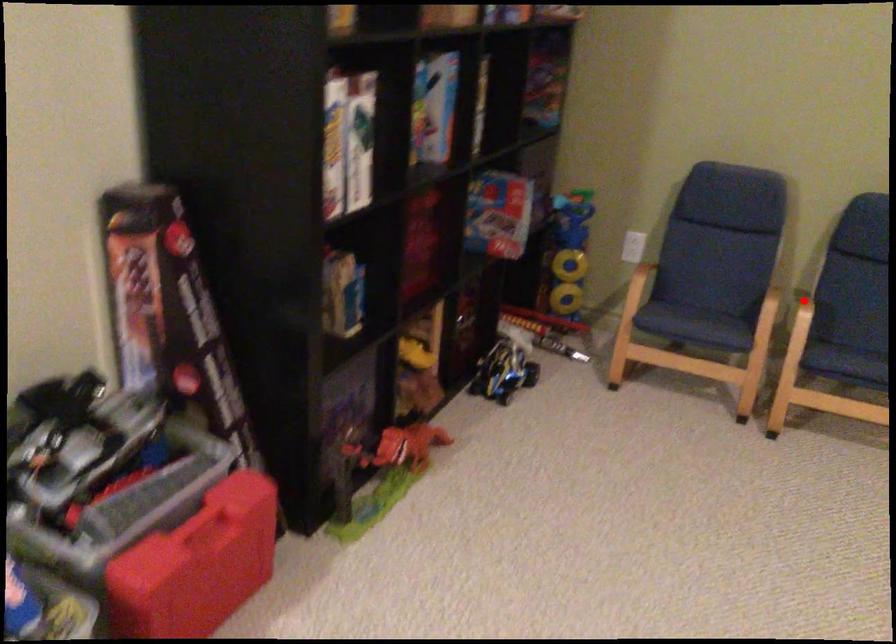
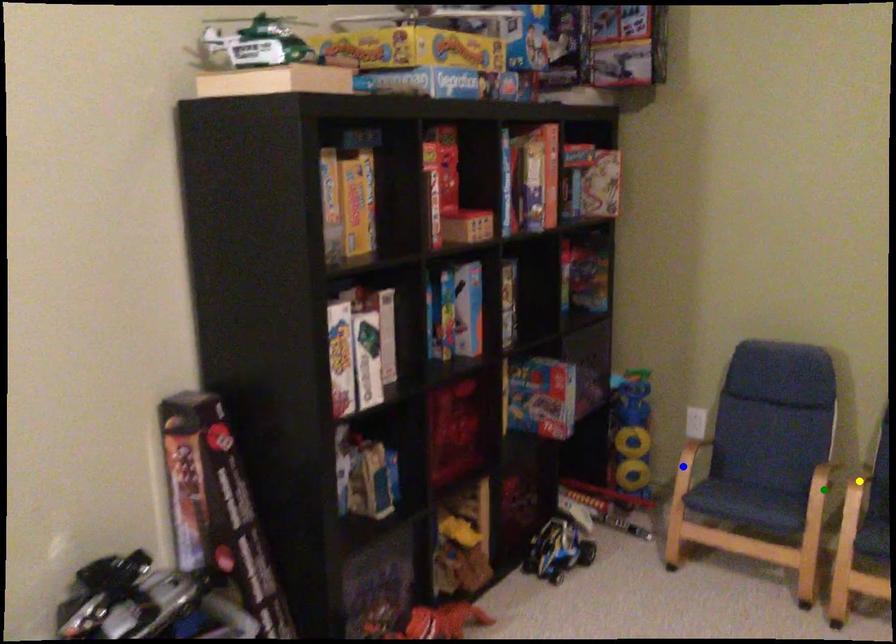
Question: I am providing you with two images of the same scene from different viewpoints. A red point is marked on the first image. You are given multiple points on the second image. Which point in image 2 is actually the same real-world point as the red point in image 1?

Choices:
 (A) blue point
 (B) yellow point
 (C) green point

Answer: (B)